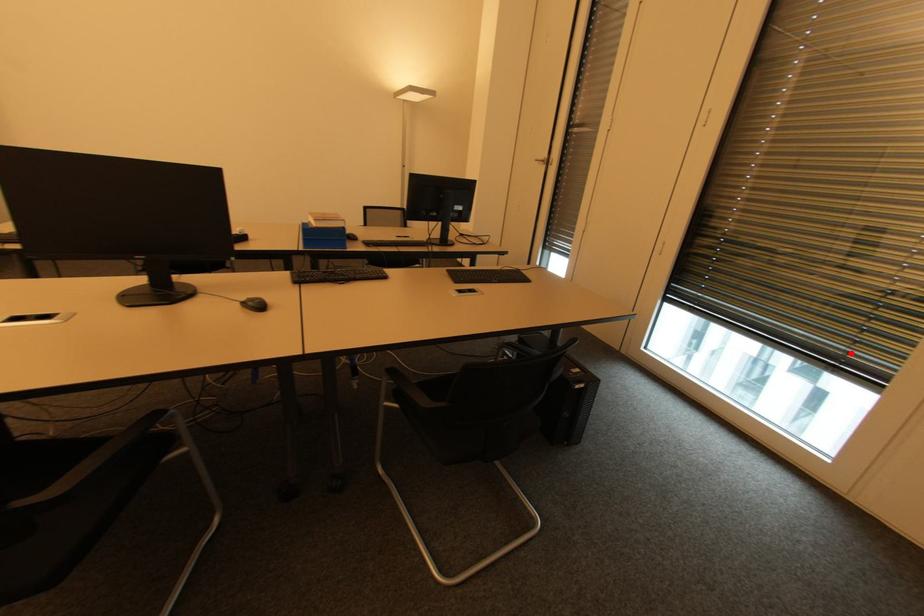
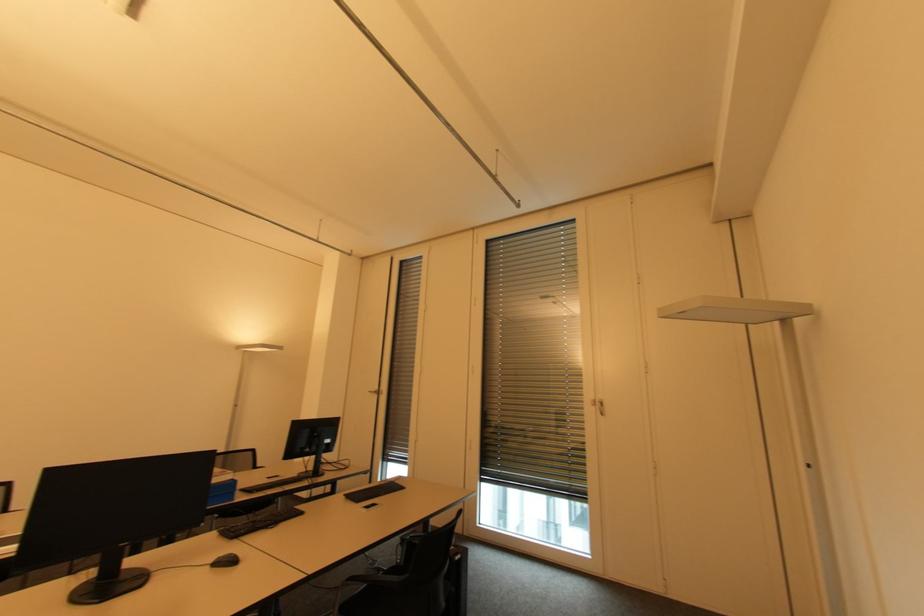
Where in the second image is the point corresponding to the highlighted location from the first image?

(573, 485)